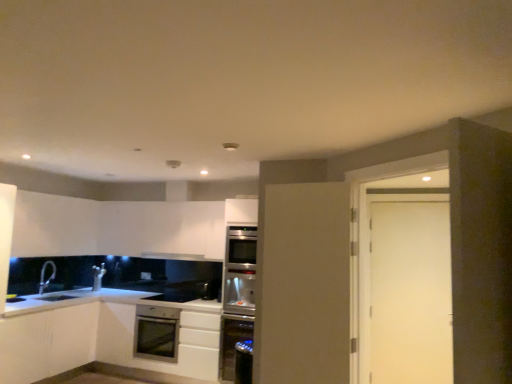
Question: In terms of height, does satin silver microwave at lower center look taller or shorter compared to satin stainless steel dishwasher at center?

Choices:
 (A) short
 (B) tall

Answer: (A)

Question: Relative to satin stainless steel dishwasher at center, is satin silver microwave at lower center in front or behind?

Choices:
 (A) behind
 (B) front

Answer: (A)

Question: Which of these objects is positioned farthest from the satin silver microwave at lower center?

Choices:
 (A) white matte door at right
 (B) satin white cabinet at lower center, the second cabinetry viewed from the left
 (C) satin silver oven at lower center
 (D) satin silver exhaust hood at upper center
 (E) silver metallic faucet at lower left

Answer: (A)

Question: Which object is positioned farthest from the satin stainless steel dishwasher at center?

Choices:
 (A) satin white cabinet at lower center, the second cabinetry viewed from the left
 (B) satin silver oven at lower center
 (C) satin silver exhaust hood at upper center
 (D) satin silver oven at center
 (E) white matte cabinet at lower left, the second cabinetry viewed from the right

Answer: (E)